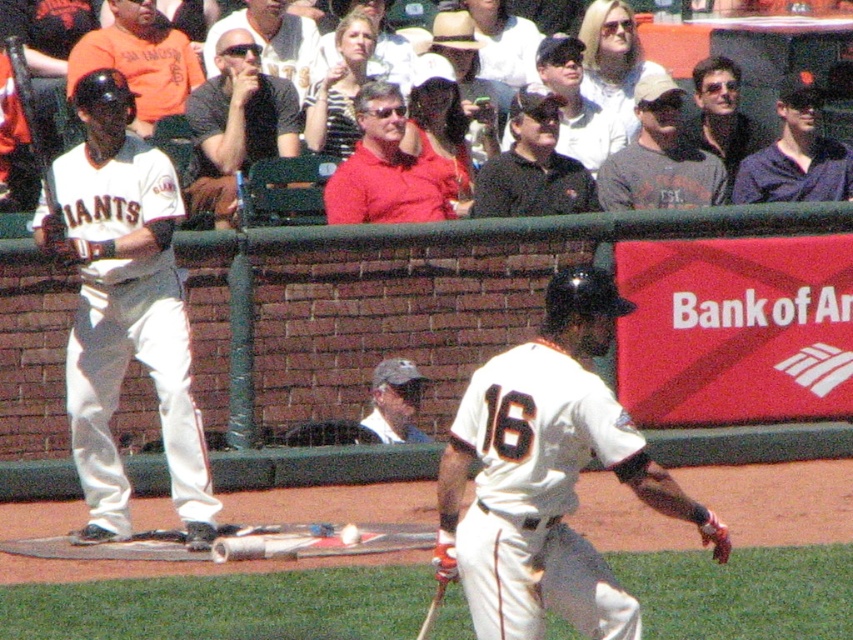
Question: Is the position of white matte uniform at center less distant than that of white matte uniform at left?

Choices:
 (A) yes
 (B) no

Answer: (A)

Question: Is white matte uniform at left bigger than matte red shirt at center?

Choices:
 (A) yes
 (B) no

Answer: (A)

Question: Which object is positioned farthest from the wooden baseball bat at lower center?

Choices:
 (A) black shirt at upper center
 (B) purple cotton shirt at upper center
 (C) black matte shirt at center

Answer: (B)

Question: Which of these objects is positioned closest to the matte red shirt at center?

Choices:
 (A) wooden baseball bat at lower center
 (B) shiny black sunglasses at upper right
 (C) black shirt at upper center

Answer: (C)

Question: Which point is farther from the camera taking this photo?

Choices:
 (A) (15, 54)
 (B) (419, 628)
 (C) (577, 208)
 (D) (397, 172)

Answer: (C)

Question: Considering the relative positions of matte black sunglasses at upper center and black matte bat at left in the image provided, where is matte black sunglasses at upper center located with respect to black matte bat at left?

Choices:
 (A) below
 (B) above

Answer: (B)